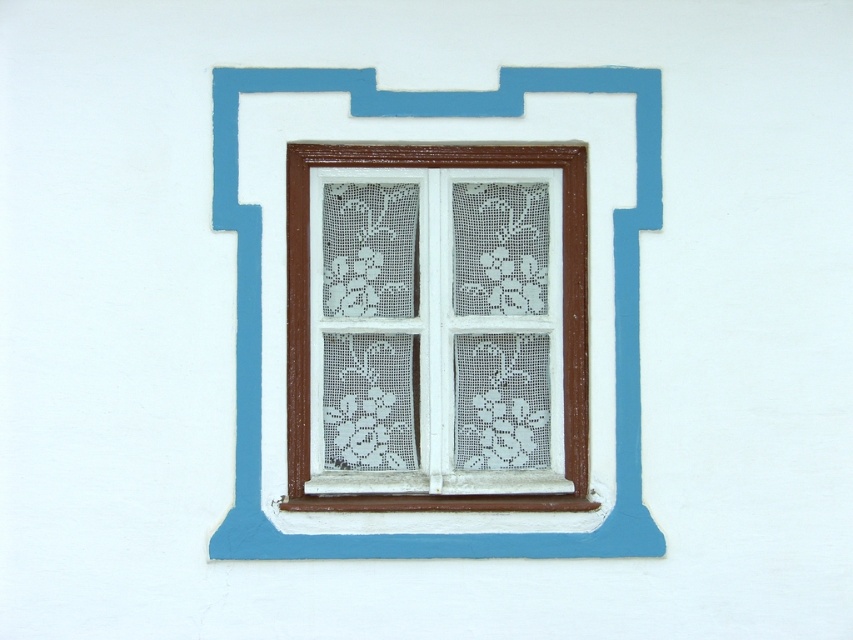
Question: Which point appears farthest from the camera in this image?

Choices:
 (A) (428, 541)
 (B) (579, 280)

Answer: (B)

Question: Which point is closer to the camera?

Choices:
 (A) (395, 432)
 (B) (248, 230)

Answer: (B)

Question: Is white lace curtain at center smaller than brown wood window frame at center?

Choices:
 (A) no
 (B) yes

Answer: (A)

Question: Is white lace curtain at center wider than brown wood window frame at center?

Choices:
 (A) yes
 (B) no

Answer: (B)

Question: Considering the relative positions of white lace curtain at center and brown wood window frame at center in the image provided, where is white lace curtain at center located with respect to brown wood window frame at center?

Choices:
 (A) left
 (B) right

Answer: (A)